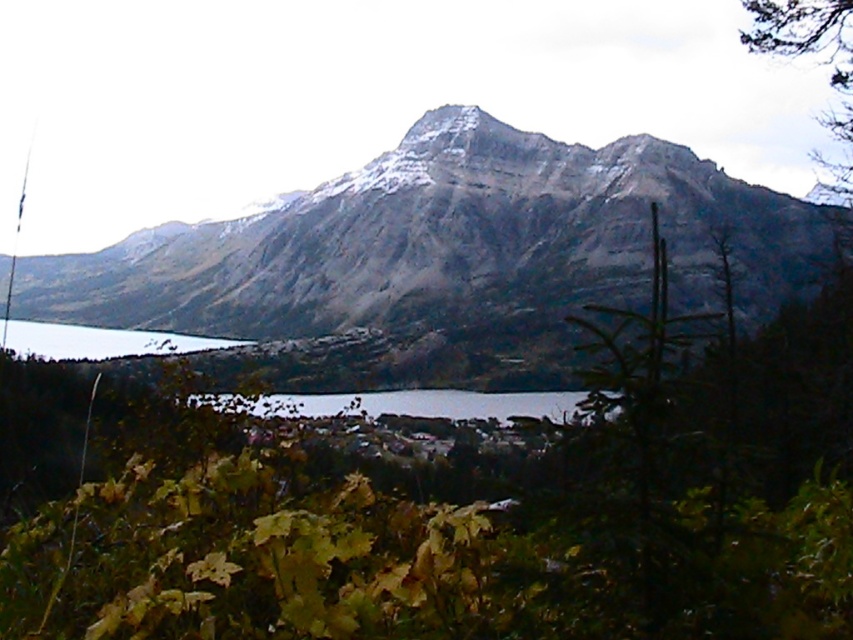
You are planning to take a photo of the snowy rock mountain at center and the clear water at lake left. Which object should you focus on first if you want to capture both in a single frame without moving the camera?

The snowy rock mountain at center has a larger size compared to clear water at lake left, so you should focus on the snowy rock mountain at center first to ensure it fills the frame appropriately before adjusting for the smaller clear water at lake left.

Consider the image. You are standing at the edge of the clear water at center and want to reach the snowy rock mountain at center. Which direction should you head towards?

The snowy rock mountain at center is to the left of clear water at center, so you should head towards the left to reach it.

You are a hiker who wants to cross the clear water at center and the clear water at lake left. Which one is lower and easier to cross?

The clear water at center is below clear water at lake left, so it is lower and easier to cross.